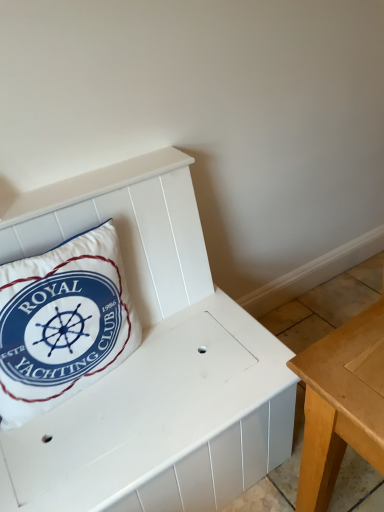
Measure the distance between point (86, 410) and camera.

3.62 feet.

What do you see at coordinates (152, 361) in the screenshot? This screenshot has height=512, width=384. I see `white matte bench at center` at bounding box center [152, 361].

At what (x,y) coordinates should I click in order to perform the action: click on white matte bench at center. Please return your answer as a coordinate pair (x, y). The width and height of the screenshot is (384, 512). Looking at the image, I should click on (152, 361).

Locate an element on the screen. The width and height of the screenshot is (384, 512). white fabric pillow at left is located at coordinates point(62,323).

This screenshot has height=512, width=384. What do you see at coordinates (62, 323) in the screenshot? I see `white fabric pillow at left` at bounding box center [62, 323].

Image resolution: width=384 pixels, height=512 pixels. I want to click on white matte bench at center, so click(x=152, y=361).

Considering the relative positions of white fabric pillow at left and white matte bench at center in the image provided, is white fabric pillow at left to the left of white matte bench at center from the viewer's perspective?

Correct, you'll find white fabric pillow at left to the left of white matte bench at center.

In the scene shown: Is the position of white fabric pillow at left less distant than that of white matte bench at center?

No, white fabric pillow at left is behind white matte bench at center.

Does point (108, 260) come farther from viewer compared to point (67, 209)?

Yes, it is behind point (67, 209).

From the image's perspective, relative to white matte bench at center, is white fabric pillow at left above or below?

From the image's perspective, white fabric pillow at left appears above white matte bench at center.

From a real-world perspective, which is physically above, white fabric pillow at left or white matte bench at center?

In real-world perspective, white fabric pillow at left is above.

Based on the photo, can you confirm if white fabric pillow at left is thinner than white matte bench at center?

Yes.

Who is shorter, white fabric pillow at left or white matte bench at center?

Standing shorter between the two is white matte bench at center.

Does white fabric pillow at left have a larger size compared to white matte bench at center?

No.

Is white matte bench at center inside white fabric pillow at left?

Definitely not — white matte bench at center is not inside white fabric pillow at left.

Looking at this image, would you consider white fabric pillow at left to be distant from white matte bench at center?

They are positioned close to each other.

In the scene shown: Is white fabric pillow at left positioned with its back to white matte bench at center?

No, white fabric pillow at left's orientation is not away from white matte bench at center.

What's the angular difference between white fabric pillow at left and white matte bench at center's facing directions?

1.04 degrees separate the facing orientations of white fabric pillow at left and white matte bench at center.

How distant is white fabric pillow at left from white matte bench at center?

A distance of 19.24 centimeters exists between white fabric pillow at left and white matte bench at center.

Identify the location of furniture in front of the white fabric pillow at left. The image size is (384, 512). (152, 361).

Does white matte bench at center appear on the right side of white fabric pillow at left?

Indeed, white matte bench at center is positioned on the right side of white fabric pillow at left.

Is the depth of white matte bench at center greater than that of white fabric pillow at left?

That is False.

Which is less distant, (122, 406) or (25, 411)?

Point (122, 406) is positioned farther from the camera compared to point (25, 411).

From the image's perspective, is white matte bench at center located beneath white fabric pillow at left?

Yes, from the image's perspective, white matte bench at center is beneath white fabric pillow at left.

From a real-world perspective, between white matte bench at center and white fabric pillow at left, who is vertically higher?

white fabric pillow at left, from a real-world perspective.

Which object is wider, white matte bench at center or white fabric pillow at left?

With larger width is white matte bench at center.

Can you confirm if white matte bench at center is taller than white fabric pillow at left?

No.

From the picture: Considering the sizes of white matte bench at center and white fabric pillow at left in the image, is white matte bench at center bigger or smaller than white fabric pillow at left?

white matte bench at center is bigger than white fabric pillow at left.

Is white matte bench at center outside of white fabric pillow at left?

Yes, white matte bench at center is outside of white fabric pillow at left.

Are white matte bench at center and white fabric pillow at left beside each other?

No, white matte bench at center is not touching white fabric pillow at left.

Is white matte bench at center oriented away from white fabric pillow at left?

white matte bench at center does not have its back to white fabric pillow at left.

What are the coordinates of `furniture that is below the white fabric pillow at left (from the image's perspective)` in the screenshot? It's located at (152, 361).

At what (x,y) coordinates should I click in order to perform the action: click on pillow that is on the left side of white matte bench at center. Please return your answer as a coordinate pair (x, y). The image size is (384, 512). Looking at the image, I should click on (62, 323).

You are a GUI agent. You are given a task and a screenshot of the screen. Output one action in this format:
    pyautogui.click(x=<x>, y=<y>)
    Task: Click on the pillow that appears above the white matte bench at center (from the image's perspective)
    The image size is (384, 512).
    Given the screenshot: What is the action you would take?
    pyautogui.click(x=62, y=323)